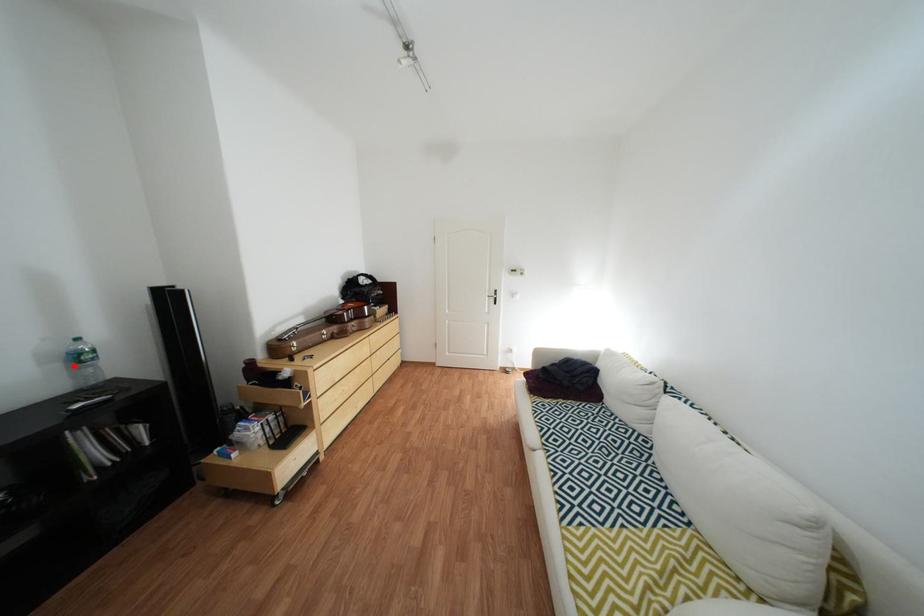
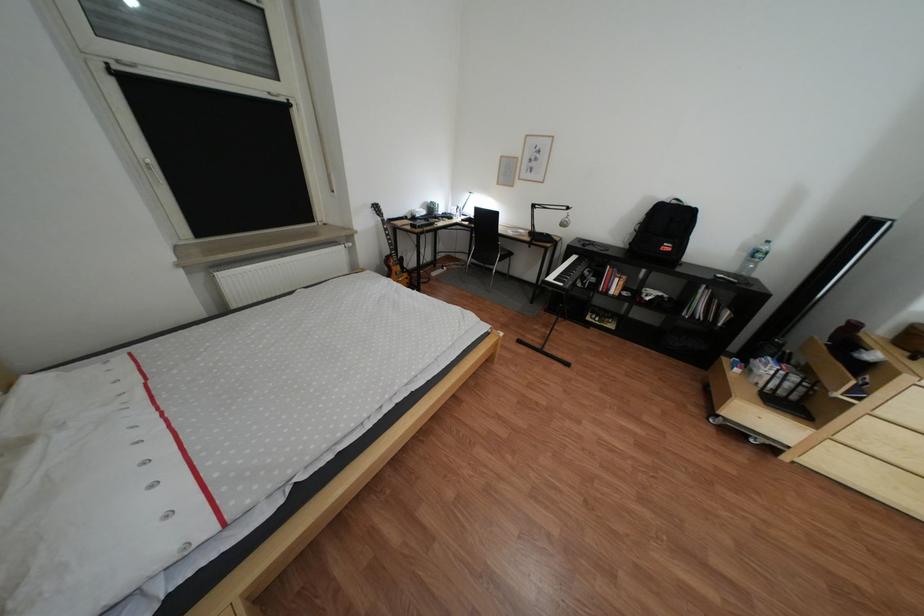
Question: I am providing you with two images of the same scene from different viewpoints. A red point is marked on the first image. At the location where the point appears in image 1, is it still visible in image 2?

Choices:
 (A) Yes
 (B) No

Answer: (A)